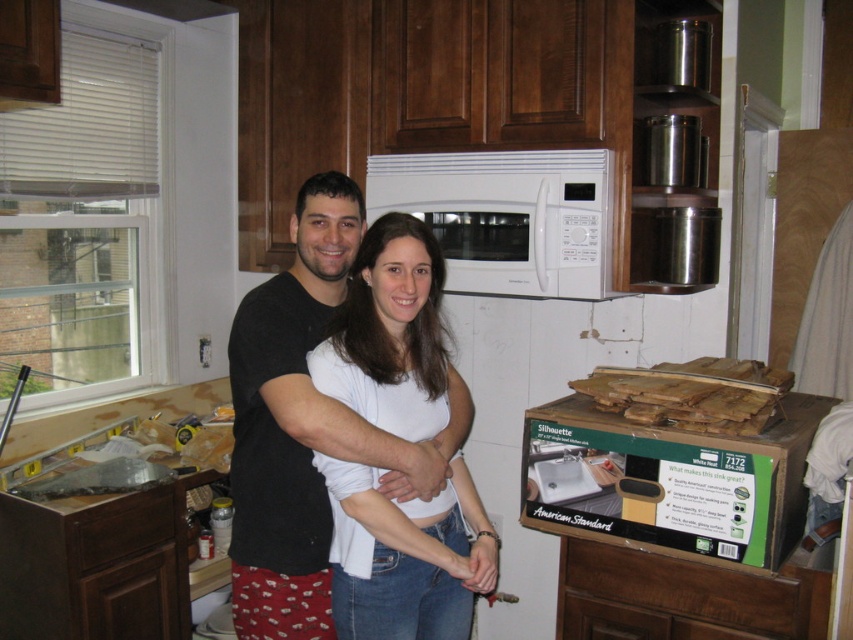
Question: Which object is farther from the camera taking this photo?

Choices:
 (A) white matte shirt at center
 (B) wooden planks at lower center
 (C) green cardboard box at lower right

Answer: (B)

Question: Does white matte shirt at center have a larger size compared to wooden planks at lower center?

Choices:
 (A) yes
 (B) no

Answer: (A)

Question: Considering the relative positions of white matte shirt at center and green cardboard box at lower right in the image provided, where is white matte shirt at center located with respect to green cardboard box at lower right?

Choices:
 (A) below
 (B) above

Answer: (B)

Question: Which of the following is the closest to the observer?

Choices:
 (A) (788, 541)
 (B) (554, 252)
 (C) (703, 381)

Answer: (A)

Question: Which object is the farthest from the wooden planks at lower center?

Choices:
 (A) white matte microwave at upper center
 (B) white matte shirt at center
 (C) green cardboard box at lower right

Answer: (B)

Question: Is green cardboard box at lower right in front of wooden planks at lower center?

Choices:
 (A) no
 (B) yes

Answer: (B)